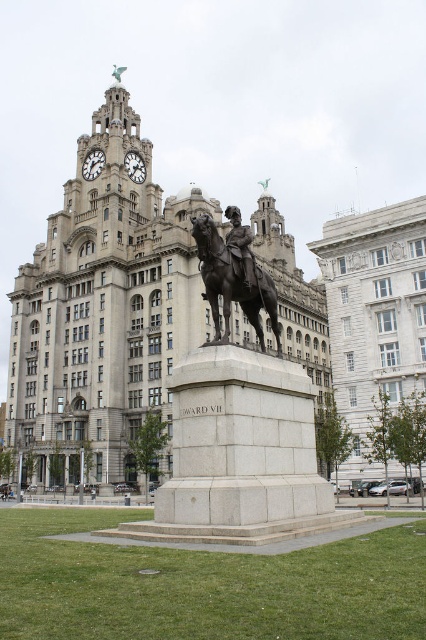
Does gray stone tower at center appear on the left side of polished bronze statue at center?

Yes, gray stone tower at center is to the left of polished bronze statue at center.

Between point (68, 196) and point (229, 220), which one is positioned in front?

Point (229, 220) is more forward.

Where is `gray stone tower at center`? This screenshot has height=640, width=426. gray stone tower at center is located at coordinates (103, 308).

Is gray stone tower at center closer to camera compared to polished bronze horse at center?

No, gray stone tower at center is behind polished bronze horse at center.

Which is more to the left, gray stone tower at center or polished bronze horse at center?

Positioned to the left is gray stone tower at center.

The width and height of the screenshot is (426, 640). Identify the location of gray stone tower at center. (103, 308).

Is polished bronze horse at center above polished bronze statue at center?

Actually, polished bronze horse at center is below polished bronze statue at center.

Which is in front, point (209, 285) or point (241, 268)?

Point (241, 268) is more forward.

Locate an element on the screen. This screenshot has width=426, height=640. polished bronze horse at center is located at coordinates (233, 276).